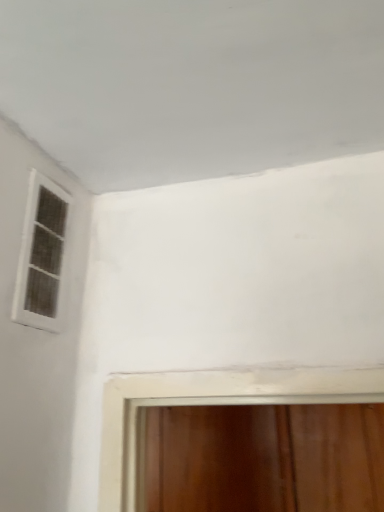
Question: From a real-world perspective, is transparent glass door at bottom, the 2th window from the top, physically located above or below white matte window at upper left, arranged as the second window when ordered from the bottom?

Choices:
 (A) below
 (B) above

Answer: (A)

Question: From the image's perspective, relative to white matte window at upper left, arranged as the second window when ordered from the bottom, is transparent glass door at bottom, the 2th window positioned from the front, above or below?

Choices:
 (A) above
 (B) below

Answer: (B)

Question: In terms of height, does transparent glass door at bottom, the 2th window positioned from the front, look taller or shorter compared to white matte window at upper left, arranged as the 1th window when viewed from the front?

Choices:
 (A) short
 (B) tall

Answer: (B)

Question: Considering the positions of white matte window at upper left, marked as the first window in a top-to-bottom arrangement, and transparent glass door at bottom, the 2th window positioned from the front, in the image, is white matte window at upper left, marked as the first window in a top-to-bottom arrangement, wider or thinner than transparent glass door at bottom, the 2th window positioned from the front,?

Choices:
 (A) thin
 (B) wide

Answer: (A)

Question: From the image's perspective, is white matte window at upper left, marked as the first window in a top-to-bottom arrangement, above or below transparent glass door at bottom, the 1th window in the right-to-left sequence?

Choices:
 (A) above
 (B) below

Answer: (A)

Question: In the image, is white matte window at upper left, marked as the first window in a top-to-bottom arrangement, on the left side or the right side of transparent glass door at bottom, placed as the 2th window when sorted from left to right?

Choices:
 (A) left
 (B) right

Answer: (A)

Question: Looking at the image, does white matte window at upper left, marked as the second window in a back-to-front arrangement, seem bigger or smaller compared to transparent glass door at bottom, the 1th window in the right-to-left sequence?

Choices:
 (A) big
 (B) small

Answer: (B)